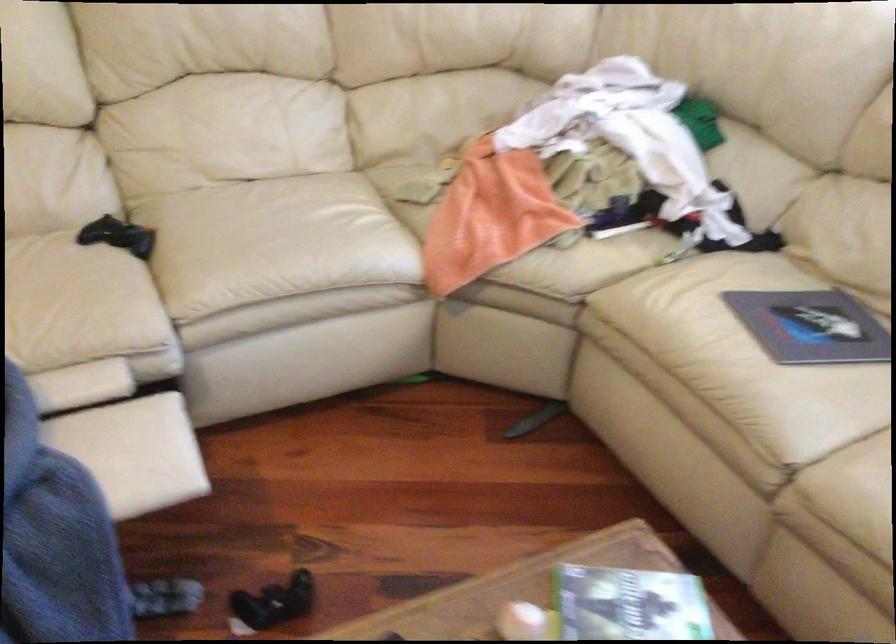
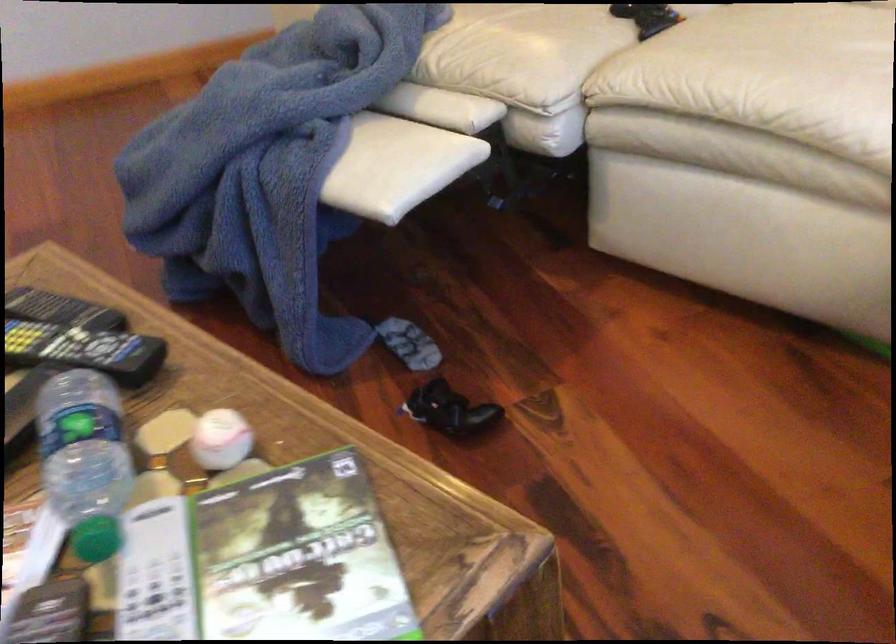
The point at [97,303] is marked in the first image. Where is the corresponding point in the second image?

(524, 51)